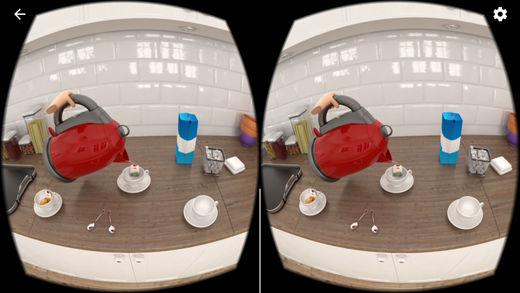
At what (x,y) coordinates should I click in order to perform the action: click on spoon. Please return your answer as a coordinate pair (x, y). Image resolution: width=520 pixels, height=293 pixels. Looking at the image, I should click on (351, 226), (373, 226), (110, 227), (90, 224).